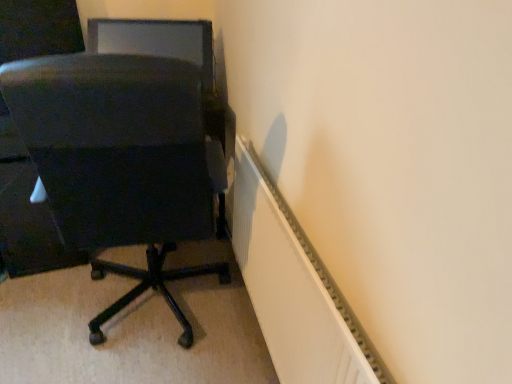
Question: Should I look upward or downward to see matte black chair at left?

Choices:
 (A) down
 (B) up

Answer: (A)

Question: From a real-world perspective, is white ribbed radiator at lower right below matte black chair at left?

Choices:
 (A) no
 (B) yes

Answer: (B)

Question: Can you confirm if white ribbed radiator at lower right is positioned to the right of matte black chair at left?

Choices:
 (A) no
 (B) yes

Answer: (B)

Question: Does white ribbed radiator at lower right appear on the left side of matte black chair at left?

Choices:
 (A) no
 (B) yes

Answer: (A)

Question: Is white ribbed radiator at lower right completely or partially outside of matte black chair at left?

Choices:
 (A) yes
 (B) no

Answer: (A)

Question: Is white ribbed radiator at lower right facing away from matte black chair at left?

Choices:
 (A) yes
 (B) no

Answer: (B)

Question: From the image's perspective, is white ribbed radiator at lower right on top of matte black chair at left?

Choices:
 (A) no
 (B) yes

Answer: (A)

Question: From a real-world perspective, is matte black chair at left beneath white ribbed radiator at lower right?

Choices:
 (A) yes
 (B) no

Answer: (B)

Question: Is matte black chair at left thinner than white ribbed radiator at lower right?

Choices:
 (A) yes
 (B) no

Answer: (B)

Question: From the image's perspective, is matte black chair at left on top of white ribbed radiator at lower right?

Choices:
 (A) yes
 (B) no

Answer: (A)

Question: Is matte black chair at left aimed at white ribbed radiator at lower right?

Choices:
 (A) no
 (B) yes

Answer: (A)

Question: Is matte black chair at left further to the viewer compared to white ribbed radiator at lower right?

Choices:
 (A) yes
 (B) no

Answer: (A)

Question: Does matte black chair at left have a greater height compared to white ribbed radiator at lower right?

Choices:
 (A) no
 (B) yes

Answer: (B)

Question: Is matte black chair at left positioned behind matte black monitor at upper left?

Choices:
 (A) no
 (B) yes

Answer: (A)